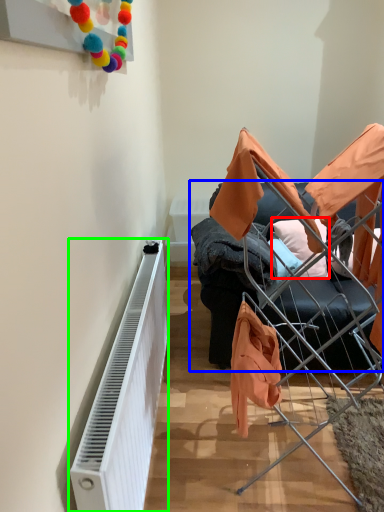
Question: Which object is the closest to the pillow (highlighted by a red box)? Choose among these: furniture (highlighted by a blue box) or radiator (highlighted by a green box).

Choices:
 (A) furniture
 (B) radiator

Answer: (A)